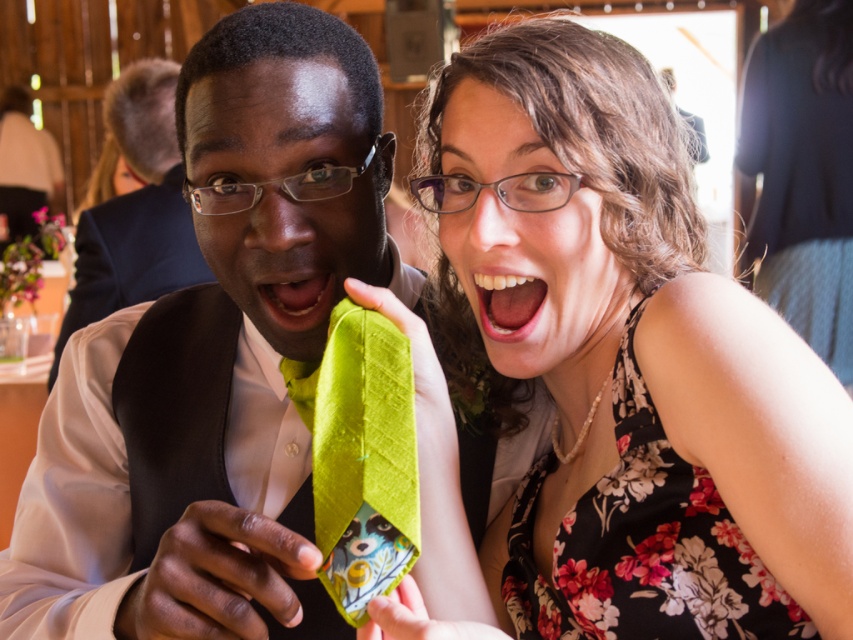
Question: Does green silk tie at center appear on the left side of bright green fabric at center?

Choices:
 (A) yes
 (B) no

Answer: (B)

Question: Is floral fabric dress at center further to camera compared to white glossy teeth at center?

Choices:
 (A) no
 (B) yes

Answer: (A)

Question: Can you confirm if floral fabric dress at center is positioned above white glossy teeth at center?

Choices:
 (A) yes
 (B) no

Answer: (B)

Question: Estimate the real-world distances between objects in this image. Which object is closer to the matte green fabric tie at left?

Choices:
 (A) green silk tie at center
 (B) floral fabric dress at center
 (C) bright green fabric at center

Answer: (C)

Question: Considering the real-world distances, which object is closest to the bright green fabric at center?

Choices:
 (A) floral fabric dress at center
 (B) matte green fabric tie at left
 (C) white glossy teeth at center

Answer: (B)

Question: Which of the following is the closest to the observer?

Choices:
 (A) floral fabric dress at center
 (B) white glossy teeth at center

Answer: (A)